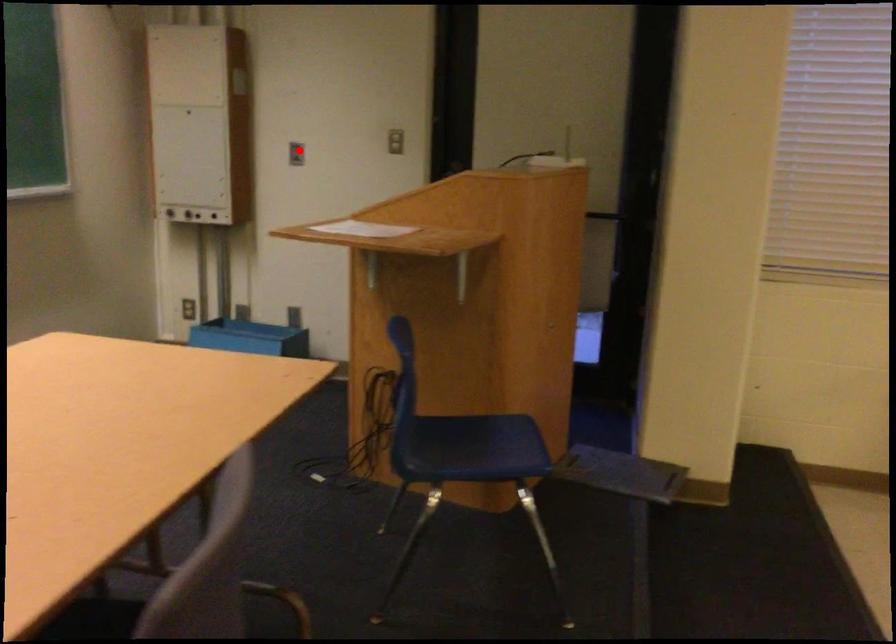
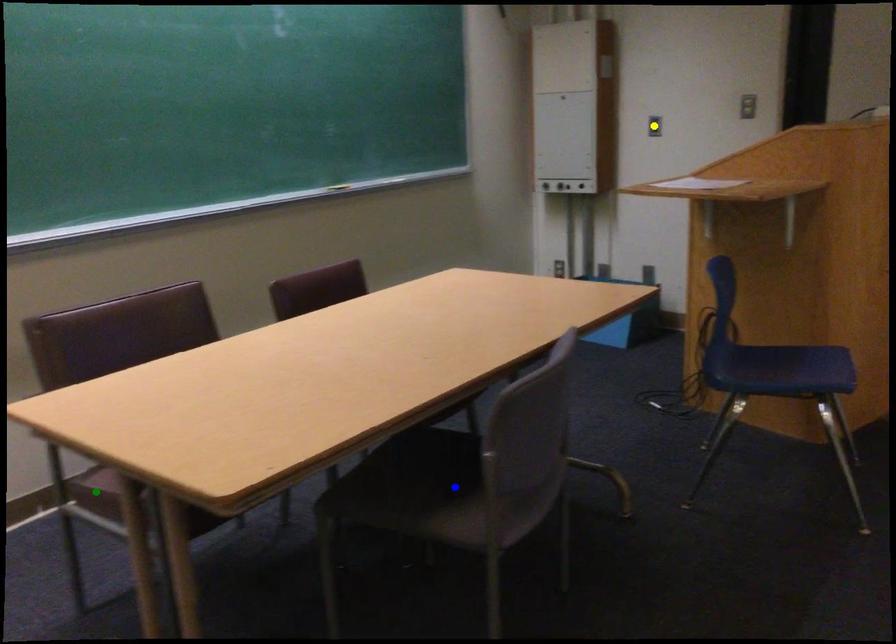
Question: I am providing you with two images of the same scene from different viewpoints. A red point is marked on the first image. You are given multiple points on the second image. Can you choose the point in image 2 that corresponds to the point in image 1?

Choices:
 (A) yellow point
 (B) green point
 (C) blue point

Answer: (A)